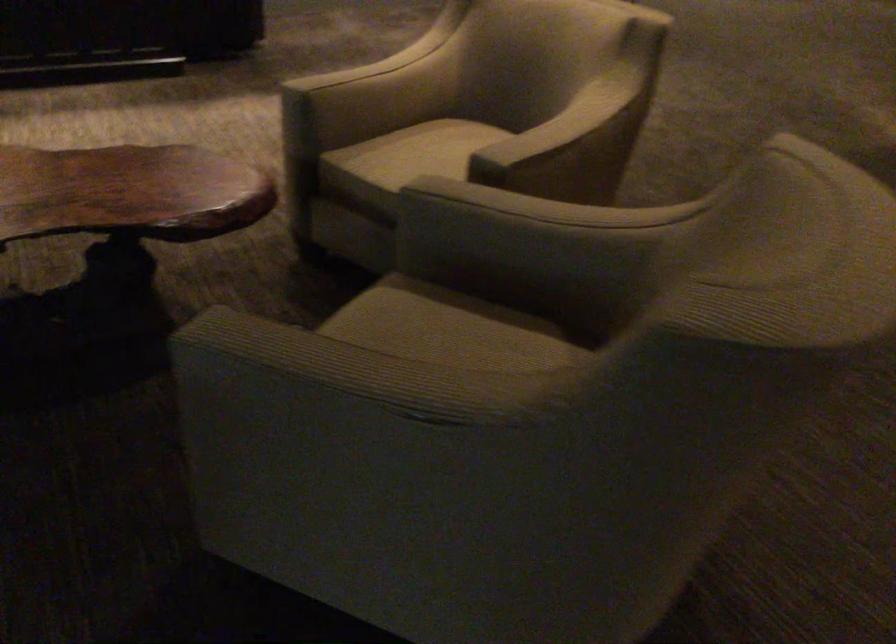
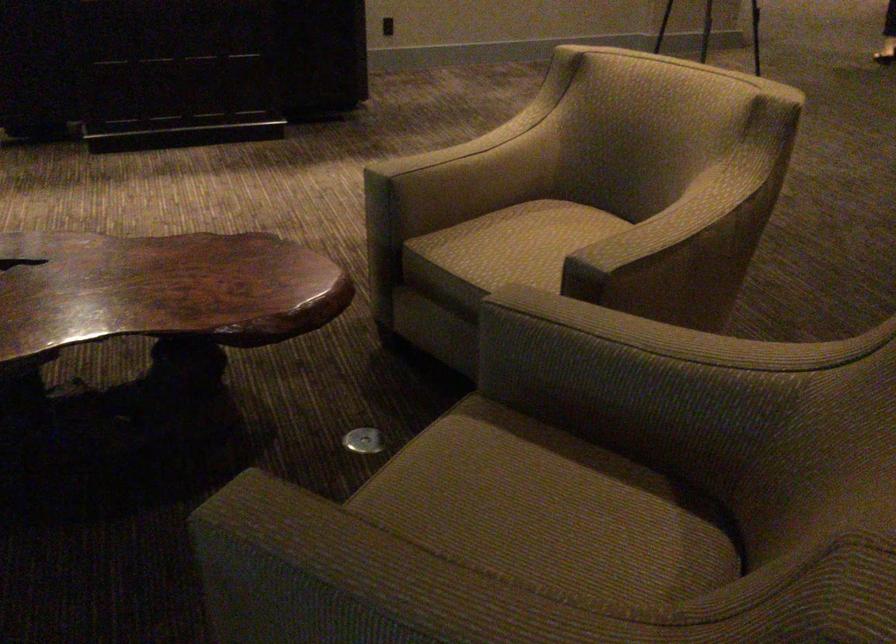
In the second image, find the point that corresponds to pixel 524 205 in the first image.

(631, 330)